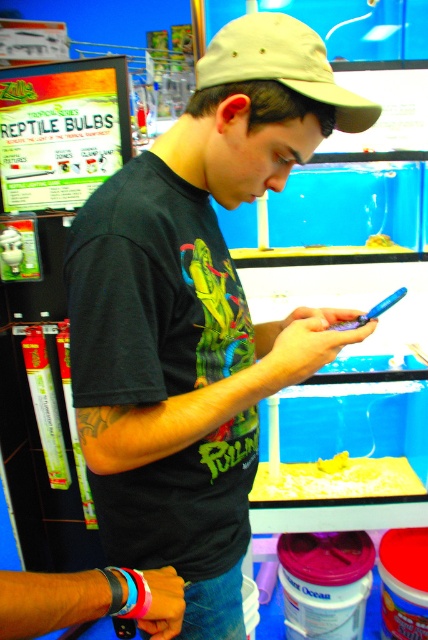
Question: Which point appears farthest from the camera in this image?

Choices:
 (A) (312, 481)
 (B) (237, 147)

Answer: (A)

Question: Is black matte t-shirt at center smaller than yellow sand at lower center?

Choices:
 (A) yes
 (B) no

Answer: (B)

Question: Which is nearer to the black matte t-shirt at center?

Choices:
 (A) beige fabric baseball cap at center
 (B) yellow sand at lower center

Answer: (A)

Question: Can you confirm if black matte t-shirt at center is positioned to the right of beige fabric baseball cap at center?

Choices:
 (A) no
 (B) yes

Answer: (A)

Question: Can you confirm if black matte t-shirt at center is wider than beige fabric baseball cap at center?

Choices:
 (A) yes
 (B) no

Answer: (A)

Question: Among these objects, which one is nearest to the camera?

Choices:
 (A) beige fabric baseball cap at center
 (B) yellow sand at lower center

Answer: (A)